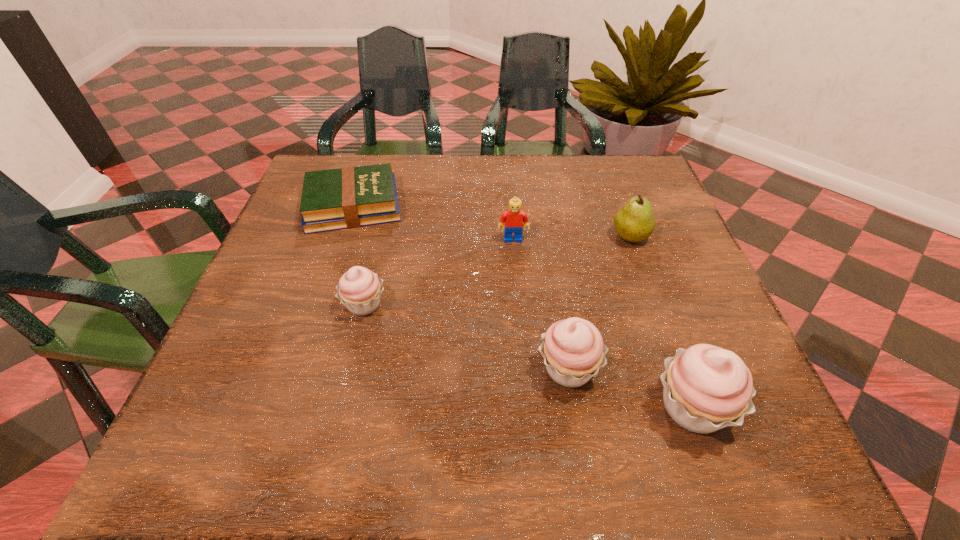
Identify the location of the farthest cupcake. The image size is (960, 540). (359, 289).

The width and height of the screenshot is (960, 540). Find the location of `the shortest cupcake`. the shortest cupcake is located at coordinates (359, 289).

Where is `the second cupcake from left to right`? the second cupcake from left to right is located at coordinates (573, 350).

Identify the location of the tallest cupcake. The height and width of the screenshot is (540, 960). (706, 388).

The width and height of the screenshot is (960, 540). I want to click on the rightmost cupcake, so click(706, 388).

The width and height of the screenshot is (960, 540). I want to click on book, so click(x=348, y=197).

Where is `pear`? This screenshot has height=540, width=960. pear is located at coordinates (634, 222).

This screenshot has height=540, width=960. What are the coordinates of `Lego` in the screenshot? It's located at (514, 217).

The image size is (960, 540). I want to click on vacant space situated 0.300m on the right of the leftmost cupcake, so click(x=540, y=305).

Identify the location of vacant space located on the left of the second cupcake from right to left. The height and width of the screenshot is (540, 960). (335, 368).